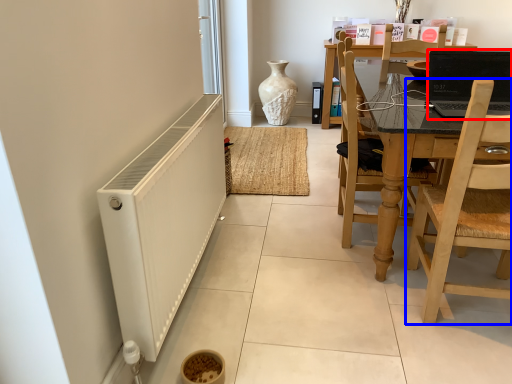
Question: Among these objects, which one is farthest to the camera, laptop (highlighted by a red box) or chair (highlighted by a blue box)?

Choices:
 (A) laptop
 (B) chair

Answer: (A)